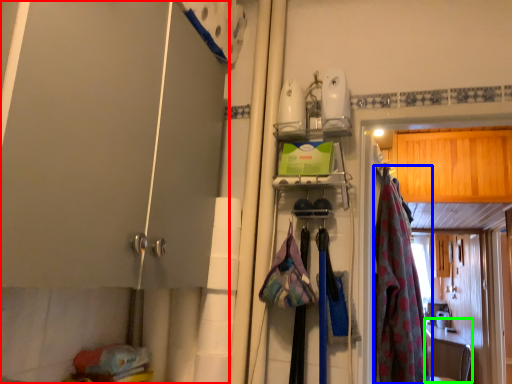
Question: Considering the real-world distances, which object is farthest from door (highlighted by a red box)? clothing (highlighted by a blue box) or counter top (highlighted by a green box)?

Choices:
 (A) clothing
 (B) counter top

Answer: (B)